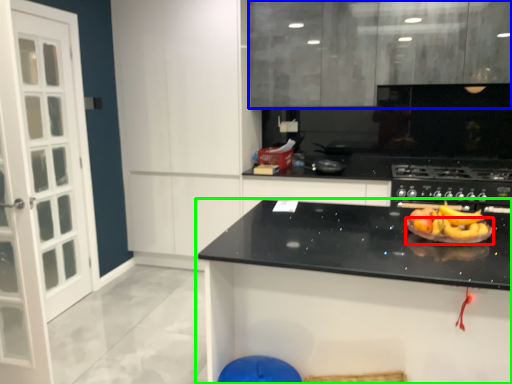
Question: Estimate the real-world distances between objects in this image. Which object is closer to paper plate (highlighted by a red box), cabinetry (highlighted by a blue box) or countertop (highlighted by a green box)?

Choices:
 (A) cabinetry
 (B) countertop

Answer: (B)